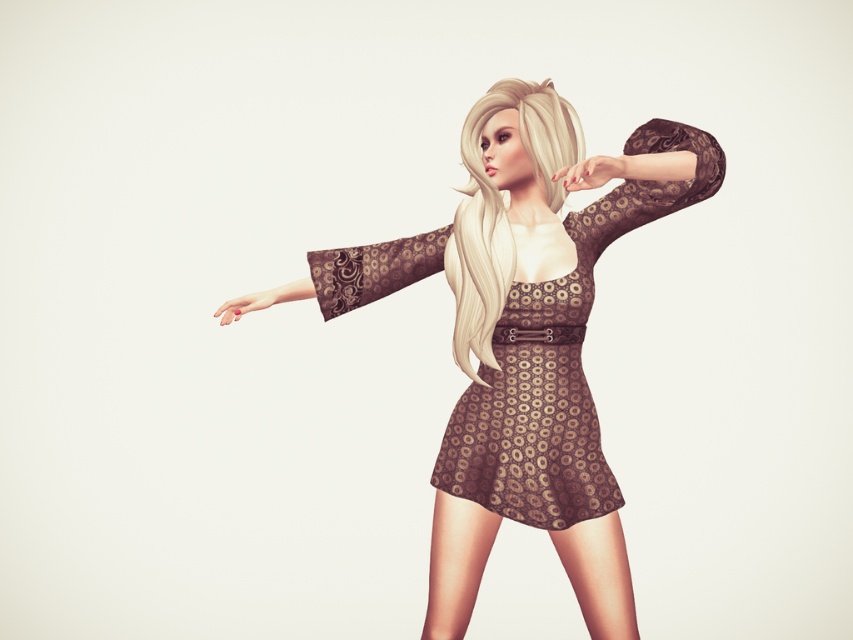
Question: Can you confirm if brown textured dress at center is smaller than brown lace sleeve at upper center?

Choices:
 (A) yes
 (B) no

Answer: (B)

Question: Among these points, which one is nearest to the camera?

Choices:
 (A) (351, 305)
 (B) (502, 108)
 (C) (253, 308)

Answer: (B)

Question: Which of the following is the closest to the observer?

Choices:
 (A) (569, 504)
 (B) (630, 176)
 (C) (405, 259)
 (D) (503, 273)

Answer: (B)

Question: Estimate the real-world distances between objects in this image. Which object is closer to the brown textured dress at center?

Choices:
 (A) brown lace sleeve at center
 (B) matte brown hand at lower left
 (C) brown lace sleeve at upper center

Answer: (C)

Question: Can you confirm if blonde silky hair at center is bigger than matte brown hand at upper center?

Choices:
 (A) yes
 (B) no

Answer: (A)

Question: Is brown lace sleeve at center thinner than matte brown hand at upper center?

Choices:
 (A) no
 (B) yes

Answer: (A)